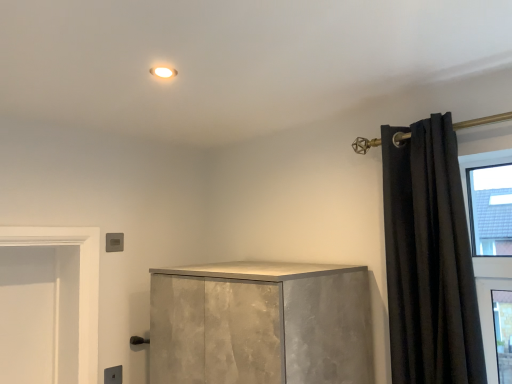
Question: Is matte gray electric outlet at lower left touching black velvet curtain at right?

Choices:
 (A) no
 (B) yes

Answer: (A)

Question: Considering the relative sizes of matte gray electric outlet at lower left and black velvet curtain at right in the image provided, is matte gray electric outlet at lower left shorter than black velvet curtain at right?

Choices:
 (A) no
 (B) yes

Answer: (B)

Question: Is matte gray electric outlet at lower left outside of black velvet curtain at right?

Choices:
 (A) yes
 (B) no

Answer: (A)

Question: Is matte gray electric outlet at lower left wider than black velvet curtain at right?

Choices:
 (A) no
 (B) yes

Answer: (A)

Question: Is matte gray electric outlet at lower left facing towards black velvet curtain at right?

Choices:
 (A) yes
 (B) no

Answer: (A)

Question: Is there a large distance between matte gray electric outlet at lower left and black velvet curtain at right?

Choices:
 (A) yes
 (B) no

Answer: (A)

Question: Can you confirm if black velvet curtain at right is thinner than matte gray electric outlet at lower left?

Choices:
 (A) no
 (B) yes

Answer: (A)

Question: Is black velvet curtain at right to the right of matte gray electric outlet at lower left from the viewer's perspective?

Choices:
 (A) yes
 (B) no

Answer: (A)

Question: Could you tell me if black velvet curtain at right is facing matte gray electric outlet at lower left?

Choices:
 (A) yes
 (B) no

Answer: (B)

Question: Can you confirm if black velvet curtain at right is shorter than matte gray electric outlet at lower left?

Choices:
 (A) yes
 (B) no

Answer: (B)

Question: Can you confirm if black velvet curtain at right is smaller than matte gray electric outlet at lower left?

Choices:
 (A) no
 (B) yes

Answer: (A)

Question: Is black velvet curtain at right wider than matte gray electric outlet at lower left?

Choices:
 (A) no
 (B) yes

Answer: (B)

Question: Would you say matte gray electric outlet at lower left is inside or outside black velvet curtain at right?

Choices:
 (A) inside
 (B) outside

Answer: (B)